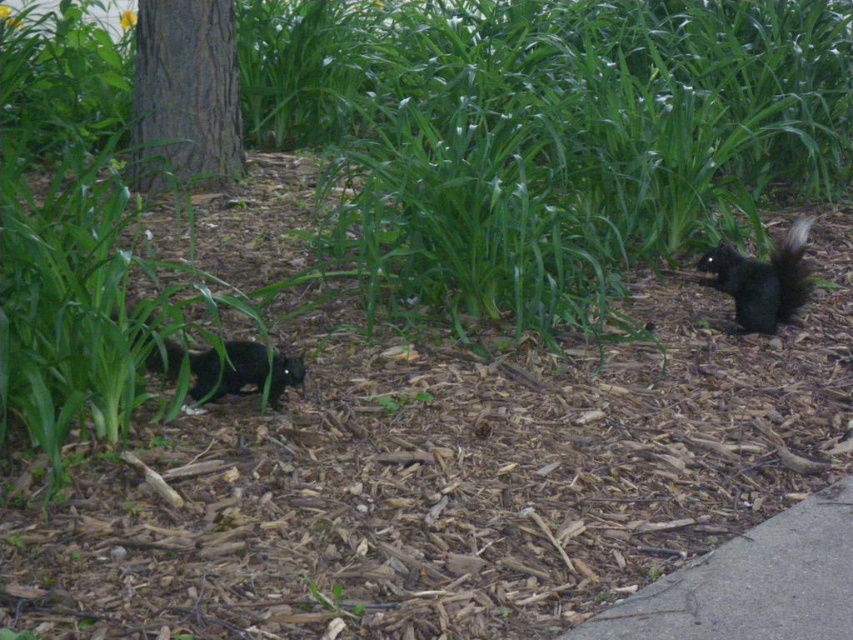
You are a photographer trying to capture a clear photo of the black furry squirrel at right and the black furry tail at right. Since the squirrels are moving, you need to focus on the bigger one first. Which one should you focus on?

The black furry squirrel at right has a larger size compared to the black furry tail at right, so you should focus on the black furry squirrel at right first.

You are a gardener standing on the gray concrete pavement at lower right and want to observe the black furry squirrel at right. Can you see the squirrel clearly from your current position?

The gray concrete pavement at lower right is in front of the black furry squirrel at right, so you cannot see the squirrel clearly from your current position because the pavement is blocking your view.